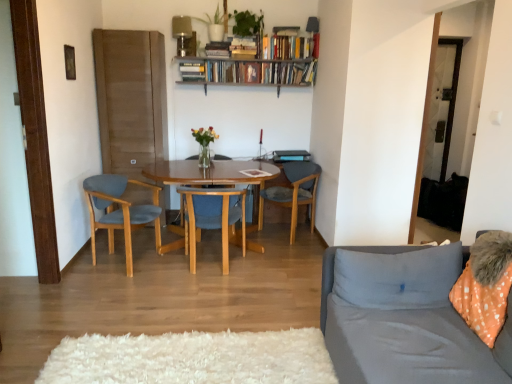
Question: Is blue fabric chair at center, the second chair positioned from the left, oriented towards hardcover books at upper center, the 3th book when ordered from left to right?

Choices:
 (A) yes
 (B) no

Answer: (B)

Question: Would you say blue fabric chair at center, the second chair positioned from the left, contains hardcover books at upper center, which appears as the 1th book when viewed from the right?

Choices:
 (A) yes
 (B) no

Answer: (B)

Question: From the image's perspective, is blue fabric chair at center, which is counted as the 2th chair, starting from the right, above hardcover books at upper center, which appears as the 1th book when viewed from the right?

Choices:
 (A) yes
 (B) no

Answer: (B)

Question: Is blue fabric chair at center, the second chair positioned from the left, oriented away from hardcover books at upper center, the 3th book when ordered from left to right?

Choices:
 (A) yes
 (B) no

Answer: (B)

Question: From the image's perspective, does blue fabric chair at center, the second chair positioned from the left, appear lower than hardcover books at upper center, the 3th book when ordered from left to right?

Choices:
 (A) no
 (B) yes

Answer: (B)

Question: Can we say blue fabric chair at center, which is counted as the 2th chair, starting from the right, lies outside hardcover books at upper center, which appears as the 1th book when viewed from the right?

Choices:
 (A) no
 (B) yes

Answer: (B)

Question: Is hardcover book at upper center, which is the third book from right to left, at the left side of hardcover books at upper center, the 3th book when ordered from left to right?

Choices:
 (A) yes
 (B) no

Answer: (A)

Question: Can hardcover books at upper center, which appears as the 1th book when viewed from the right, be found inside hardcover book at upper center, which is the first book in left-to-right order?

Choices:
 (A) yes
 (B) no

Answer: (B)

Question: From the image's perspective, is hardcover book at upper center, which is the third book from right to left, over hardcover books at upper center, which appears as the 1th book when viewed from the right?

Choices:
 (A) no
 (B) yes

Answer: (A)

Question: Is hardcover book at upper center, which is the third book from right to left, located outside hardcover books at upper center, the 3th book when ordered from left to right?

Choices:
 (A) yes
 (B) no

Answer: (A)

Question: Is hardcover book at upper center, which is the first book in left-to-right order, closer to camera compared to hardcover books at upper center, which appears as the 1th book when viewed from the right?

Choices:
 (A) yes
 (B) no

Answer: (B)

Question: Can you confirm if hardcover book at upper center, which is the first book in left-to-right order, is thinner than hardcover books at upper center, which appears as the 1th book when viewed from the right?

Choices:
 (A) no
 (B) yes

Answer: (A)

Question: From a real-world perspective, is hardcover books at upper center, the 3th book when ordered from left to right, on gray fabric couch at right?

Choices:
 (A) yes
 (B) no

Answer: (A)